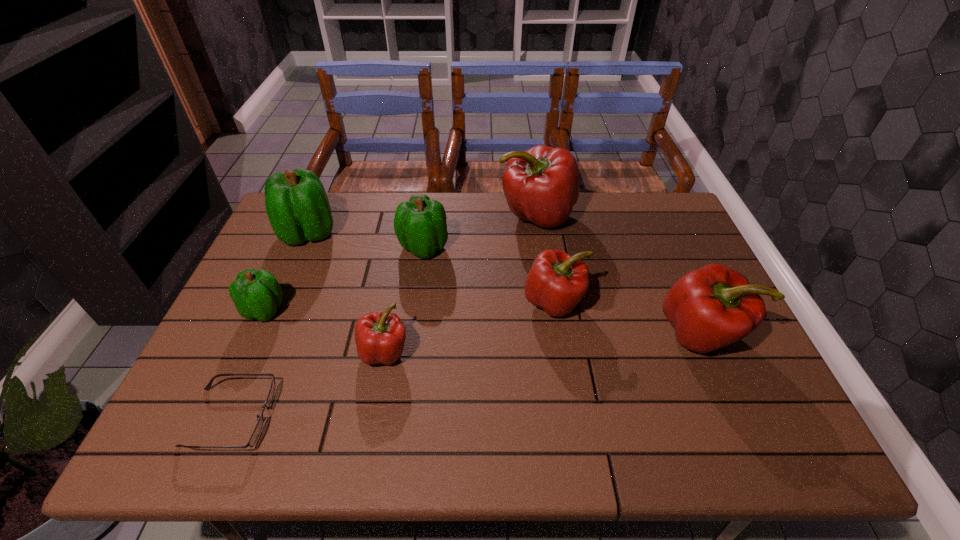
You are a GUI agent. You are given a task and a screenshot of the screen. Output one action in this format:
    pyautogui.click(x=<x>, y=<y>)
    Task: Click on the biggest pink bell pepper
    The height and width of the screenshot is (540, 960).
    Given the screenshot: What is the action you would take?
    pyautogui.click(x=541, y=185)

Where is `the biggest green bell pepper`? Image resolution: width=960 pixels, height=540 pixels. the biggest green bell pepper is located at coordinates (297, 205).

Where is `the rightmost bell pepper`? The height and width of the screenshot is (540, 960). the rightmost bell pepper is located at coordinates (714, 306).

At what (x,y) coordinates should I click in order to perform the action: click on the third smallest pink bell pepper. Please return your answer as a coordinate pair (x, y). The image size is (960, 540). Looking at the image, I should click on (714, 306).

The height and width of the screenshot is (540, 960). I want to click on the rightmost green bell pepper, so click(x=420, y=225).

Where is `the second smallest pink bell pepper`? The image size is (960, 540). the second smallest pink bell pepper is located at coordinates (556, 282).

Locate an element on the screen. This screenshot has height=540, width=960. the nearest green bell pepper is located at coordinates (256, 294).

I want to click on the smallest pink bell pepper, so click(380, 337).

Identify the location of the shortest object. (253, 438).

You are a GUI agent. You are given a task and a screenshot of the screen. Output one action in this format:
    pyautogui.click(x=<x>, y=<y>)
    Task: Click on the nearest object
    The height and width of the screenshot is (540, 960).
    Given the screenshot: What is the action you would take?
    pyautogui.click(x=253, y=438)